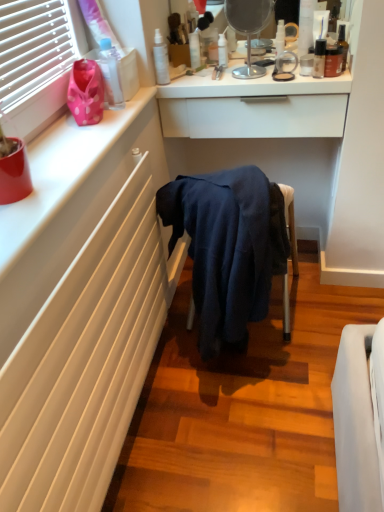
Question: Is transparent plastic bottle at upper center, arranged as the third toiletry when viewed from the left, touching white glossy drawer at upper center?

Choices:
 (A) no
 (B) yes

Answer: (A)

Question: Is transparent plastic bottle at upper center, which ranks as the sixth toiletry in right-to-left order, further to camera compared to white glossy drawer at upper center?

Choices:
 (A) yes
 (B) no

Answer: (A)

Question: Is white glossy drawer at upper center located within transparent plastic bottle at upper center, arranged as the third toiletry when viewed from the left?

Choices:
 (A) yes
 (B) no

Answer: (B)

Question: Is transparent plastic bottle at upper center, arranged as the third toiletry when viewed from the left, not within white glossy drawer at upper center?

Choices:
 (A) no
 (B) yes

Answer: (B)

Question: Considering the relative sizes of transparent plastic bottle at upper center, which ranks as the sixth toiletry in right-to-left order, and white glossy drawer at upper center in the image provided, is transparent plastic bottle at upper center, which ranks as the sixth toiletry in right-to-left order, smaller than white glossy drawer at upper center?

Choices:
 (A) no
 (B) yes

Answer: (B)

Question: Is matte brown bottle at upper right, the seventh toiletry in the left-to-right sequence, in front of or behind transparent plastic bottle at upper center, arranged as the third toiletry when viewed from the left, in the image?

Choices:
 (A) behind
 (B) front

Answer: (B)

Question: Is matte brown bottle at upper right, the seventh toiletry in the left-to-right sequence, bigger or smaller than transparent plastic bottle at upper center, arranged as the third toiletry when viewed from the left?

Choices:
 (A) small
 (B) big

Answer: (B)

Question: From a real-world perspective, is matte brown bottle at upper right, the seventh toiletry in the left-to-right sequence, physically located above or below transparent plastic bottle at upper center, arranged as the third toiletry when viewed from the left?

Choices:
 (A) below
 (B) above

Answer: (A)

Question: Does point tap(334, 49) appear closer or farther from the camera than point tap(195, 42)?

Choices:
 (A) closer
 (B) farther

Answer: (A)

Question: In terms of height, does white glossy drawer at upper center look taller or shorter compared to satin black bottle at upper right, the 3th toiletry from the right?

Choices:
 (A) tall
 (B) short

Answer: (A)

Question: Is white glossy drawer at upper center wider or thinner than satin black bottle at upper right, placed as the sixth toiletry when sorted from left to right?

Choices:
 (A) thin
 (B) wide

Answer: (B)

Question: From the image's perspective, is white glossy drawer at upper center above or below satin black bottle at upper right, placed as the sixth toiletry when sorted from left to right?

Choices:
 (A) above
 (B) below

Answer: (B)

Question: Is white glossy drawer at upper center in front of or behind satin black bottle at upper right, placed as the sixth toiletry when sorted from left to right, in the image?

Choices:
 (A) front
 (B) behind

Answer: (B)

Question: From the image's perspective, is transparent plastic bottle at upper left, which is the first toiletry from left to right, located above or below satin white spray bottle at upper center, marked as the seventh toiletry in a right-to-left arrangement?

Choices:
 (A) above
 (B) below

Answer: (B)

Question: Considering the positions of point (x=109, y=88) and point (x=163, y=81), is point (x=109, y=88) closer or farther from the camera than point (x=163, y=81)?

Choices:
 (A) closer
 (B) farther

Answer: (A)